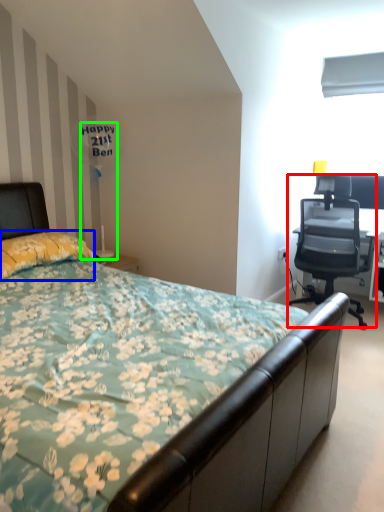
Question: Estimate the real-world distances between objects in this image. Which object is farther from chair (highlighted by a red box), pillow (highlighted by a blue box) or table lamp (highlighted by a green box)?

Choices:
 (A) pillow
 (B) table lamp

Answer: (A)